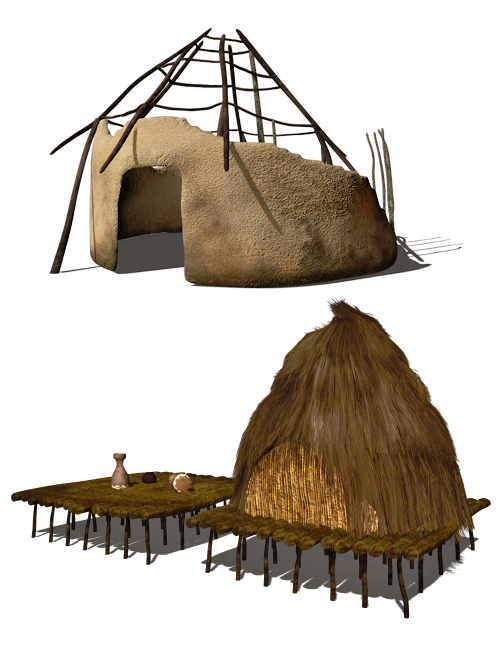
The width and height of the screenshot is (500, 650). Find the location of `entrance`. entrance is located at coordinates (284, 482).